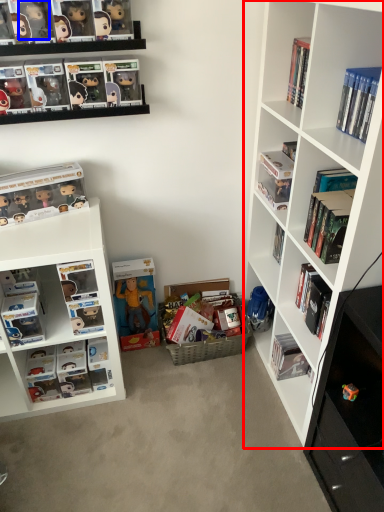
Question: Among these objects, which one is nearest to the camera, shelf (highlighted by a red box) or toy (highlighted by a blue box)?

Choices:
 (A) shelf
 (B) toy

Answer: (A)